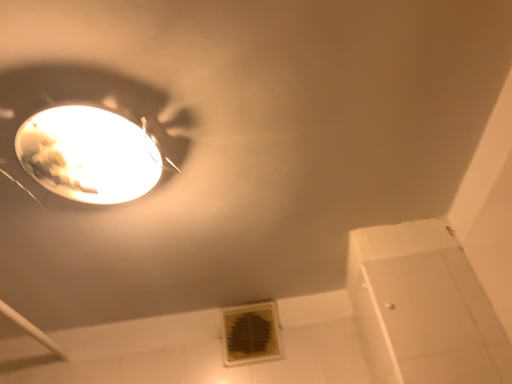
Question: From a real-world perspective, is white plastic air conditioning at lower center on top of matte white lamp at upper left?

Choices:
 (A) yes
 (B) no

Answer: (B)

Question: Are white plastic air conditioning at lower center and matte white lamp at upper left making contact?

Choices:
 (A) no
 (B) yes

Answer: (A)

Question: Considering the relative sizes of white plastic air conditioning at lower center and matte white lamp at upper left in the image provided, is white plastic air conditioning at lower center smaller than matte white lamp at upper left?

Choices:
 (A) no
 (B) yes

Answer: (B)

Question: Does white plastic air conditioning at lower center have a greater height compared to matte white lamp at upper left?

Choices:
 (A) yes
 (B) no

Answer: (A)

Question: Can you confirm if white plastic air conditioning at lower center is thinner than matte white lamp at upper left?

Choices:
 (A) yes
 (B) no

Answer: (A)

Question: From the image's perspective, would you say white plastic air conditioning at lower center is shown under matte white lamp at upper left?

Choices:
 (A) no
 (B) yes

Answer: (B)

Question: Can you confirm if matte white lamp at upper left is positioned to the left of white plastic air conditioning at lower center?

Choices:
 (A) yes
 (B) no

Answer: (A)

Question: Is matte white lamp at upper left to the right of white plastic air conditioning at lower center from the viewer's perspective?

Choices:
 (A) yes
 (B) no

Answer: (B)

Question: Can you see matte white lamp at upper left touching white plastic air conditioning at lower center?

Choices:
 (A) yes
 (B) no

Answer: (B)

Question: Is white plastic air conditioning at lower center at the back of matte white lamp at upper left?

Choices:
 (A) yes
 (B) no

Answer: (A)

Question: Is matte white lamp at upper left positioned behind white plastic air conditioning at lower center?

Choices:
 (A) no
 (B) yes

Answer: (A)

Question: Is matte white lamp at upper left facing towards white plastic air conditioning at lower center?

Choices:
 (A) no
 (B) yes

Answer: (A)

Question: Is white plastic air conditioning at lower center wider or thinner than matte white lamp at upper left?

Choices:
 (A) thin
 (B) wide

Answer: (A)